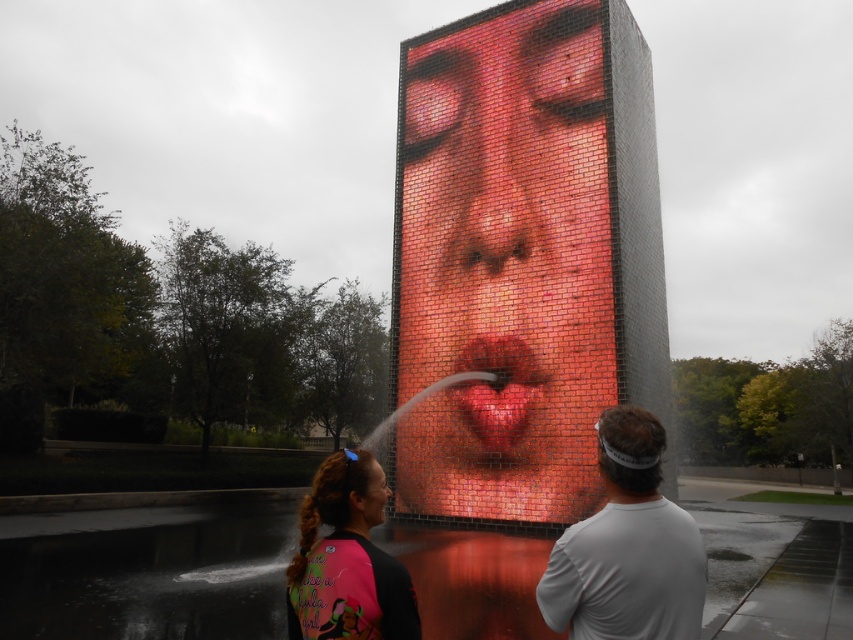
Question: Which object appears closest to the camera in this image?

Choices:
 (A) pink fabric at lower center
 (B) brick mosaic face at center
 (C) matte plastic face at center
 (D) white matte shirt at center

Answer: (D)

Question: Which point is closer to the camera taking this photo?

Choices:
 (A) (390, 492)
 (B) (577, 480)
 (C) (370, 518)

Answer: (C)

Question: Where is white matte shirt at center located in relation to pink fabric at lower center in the image?

Choices:
 (A) left
 (B) right

Answer: (B)

Question: Does brick mosaic face at center appear on the left side of white matte shirt at center?

Choices:
 (A) no
 (B) yes

Answer: (A)

Question: Which is nearer to the brick mosaic face at center?

Choices:
 (A) matte plastic face at center
 (B) smooth glossy lips at center
 (C) white matte shirt at center

Answer: (B)

Question: Can you confirm if brick mosaic face at center is positioned above matte plastic face at center?

Choices:
 (A) yes
 (B) no

Answer: (B)